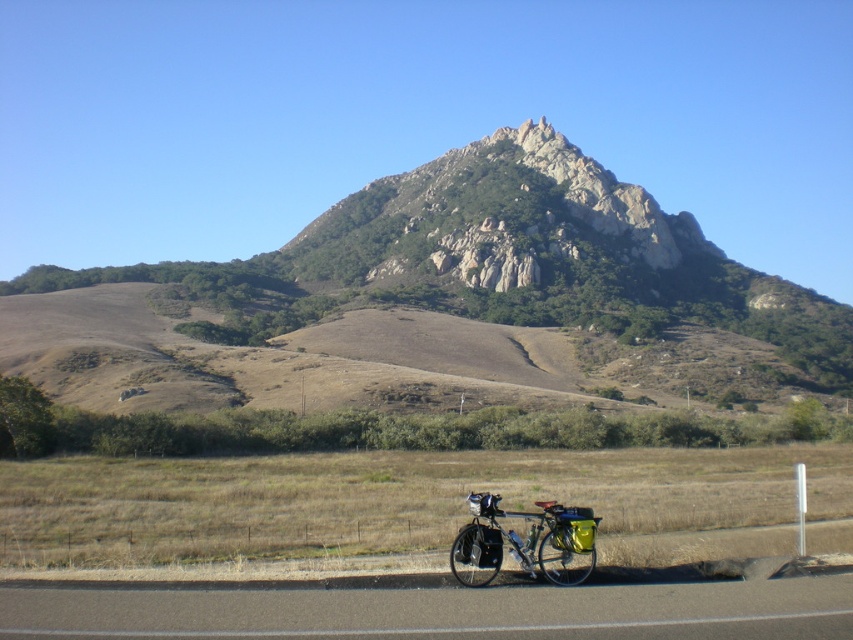
Question: Among these points, which one is nearest to the camera?

Choices:
 (A) (512, 552)
 (B) (285, 246)
 (C) (312, 246)
 (D) (16, 547)

Answer: (A)

Question: Which is farther from the shiny metallic bicycle at lower center?

Choices:
 (A) rugged stone mountain at center
 (B) rocky at center

Answer: (A)

Question: Estimate the real-world distances between objects in this image. Which object is closer to the rugged stone mountain at center?

Choices:
 (A) green grassy field at lower center
 (B) shiny metallic bicycle at lower center

Answer: (A)

Question: Is rugged stone mountain at center wider than shiny metallic bicycle at lower center?

Choices:
 (A) yes
 (B) no

Answer: (A)

Question: Is rugged stone mountain at center smaller than shiny metallic bicycle at lower center?

Choices:
 (A) no
 (B) yes

Answer: (A)

Question: Can you confirm if green grassy field at lower center is positioned to the right of rugged stone mountain at center?

Choices:
 (A) yes
 (B) no

Answer: (B)